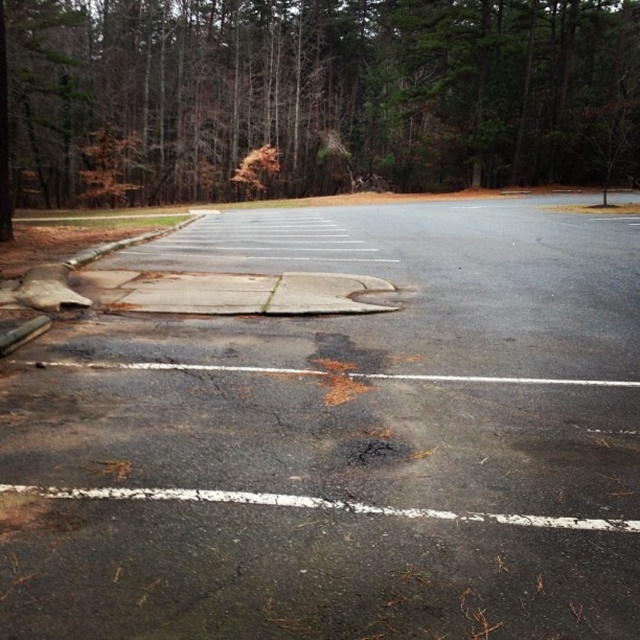
You are a construction worker needing to transport materials from the brown textured tree at upper center to the cracked asphalt at center. Can you use a standard 20 foot long truck trailer for this task? Please explain your reasoning based on the distance provided.

The distance between the brown textured tree at upper center and the cracked asphalt at center is 24.09 meters. A standard 20 foot long truck trailer measures approximately 6.1 meters. Since 24.09 meters is significantly longer than 6.1 meters, the trailer cannot cover the entire distance. Therefore, the materials would need to be transported in multiple trips or using a longer vehicle.

You are a delivery truck driver who needs to park in the black asphalt parking lot at center. The truck is 2.5 meters wide. Can the truck fit into the parking lot if the brown textured tree at upper center is blocking part of the space?

The black asphalt parking lot at center is narrower than the brown textured tree at upper center. Since the tree is blocking part of the space, the truck may not fit. Check the available width before proceeding.